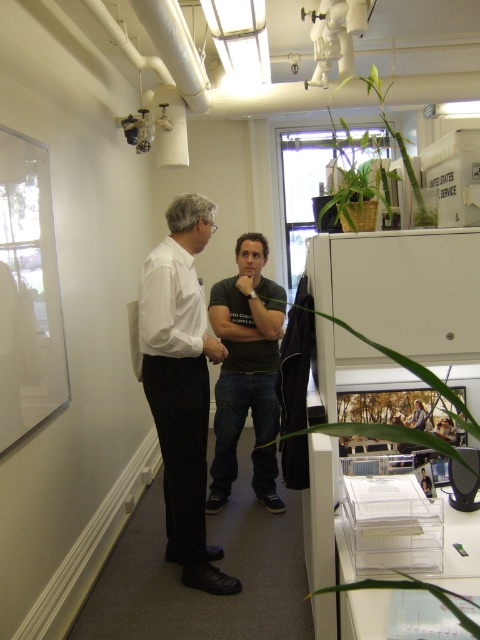
Does point (242, 355) lie in front of point (384, 433)?

No, (242, 355) is further to viewer.

Who is taller, dark green t-shirt at center or green leafy plant at right?

Standing taller between the two is dark green t-shirt at center.

Measure the distance between dark green t-shirt at center and camera.

dark green t-shirt at center is 10.03 feet from camera.

This screenshot has width=480, height=640. I want to click on dark green t-shirt at center, so click(x=243, y=358).

Does white smooth shirt at center have a larger size compared to green leafy plant at upper center?

No, white smooth shirt at center is not bigger than green leafy plant at upper center.

Is white smooth shirt at center wider than green leafy plant at upper center?

In fact, white smooth shirt at center might be narrower than green leafy plant at upper center.

I want to click on white smooth shirt at center, so click(x=181, y=385).

Can you confirm if dark green t-shirt at center is positioned above green leafy plant at lower right?

Yes, dark green t-shirt at center is above green leafy plant at lower right.

Does point (269, 308) come in front of point (399, 572)?

No, (269, 308) is further to viewer.

The image size is (480, 640). In order to click on dark green t-shirt at center in this screenshot , I will do `click(243, 358)`.

You are a GUI agent. You are given a task and a screenshot of the screen. Output one action in this format:
    pyautogui.click(x=<x>, y=<y>)
    Task: Click on the dark green t-shirt at center
    
    Given the screenshot: What is the action you would take?
    pyautogui.click(x=243, y=358)